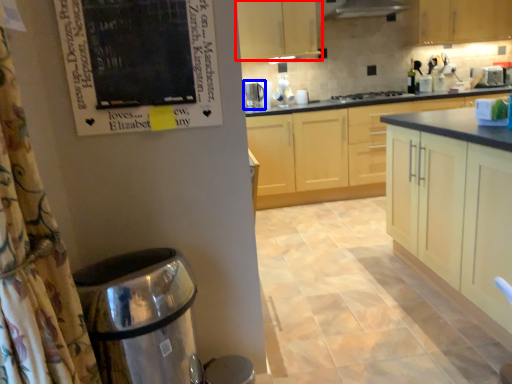
Question: Among these objects, which one is nearest to the camera, cabinetry (highlighted by a red box) or kitchen appliance (highlighted by a blue box)?

Choices:
 (A) cabinetry
 (B) kitchen appliance

Answer: (A)